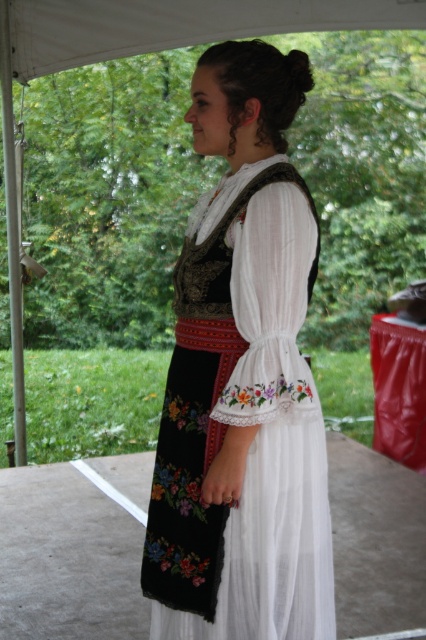
You are a photographer trying to capture the white embroidered dress at center in the image. What are the exact coordinates where you should focus your camera to ensure the dress is centered in the frame?

The white embroidered dress at center is located at coordinates point (242, 380), so you should focus your camera there to center it in the frame.

Imagine you are taking a photo of the scene described. You notice two points marked in the image at coordinates point (287, 436) and point (14, 0). Which of these points is closer to the camera lens?

Point (287, 436) is closer to the camera lens than point (14, 0).